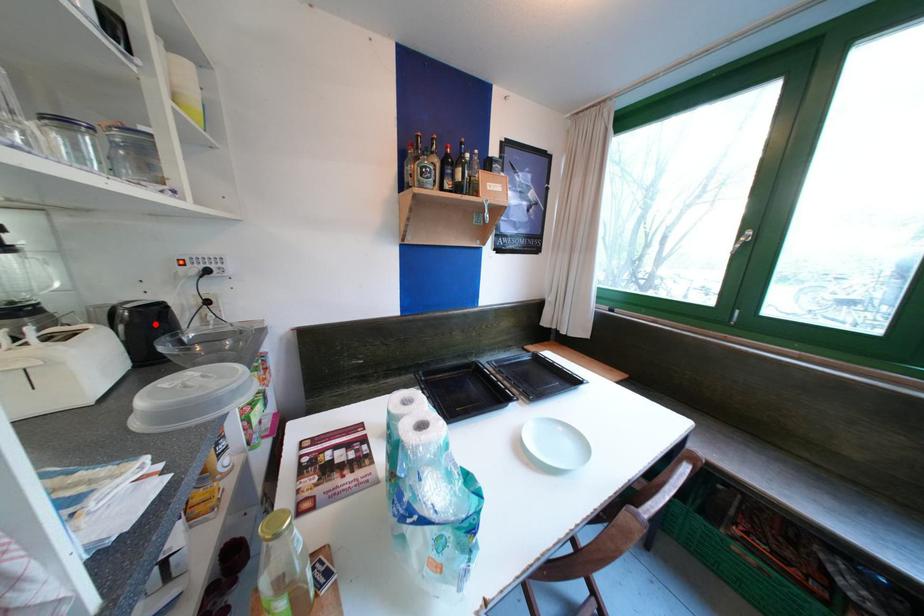
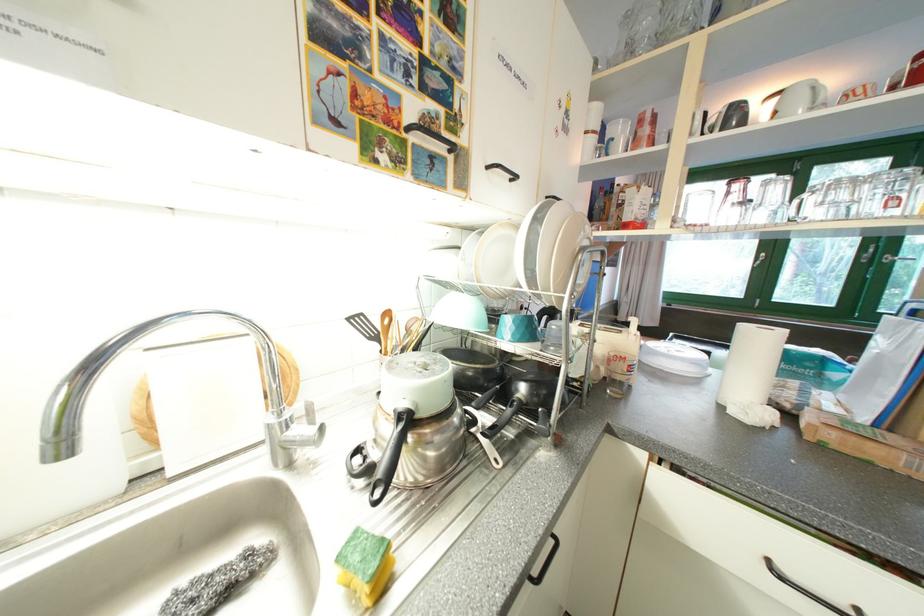
Question: I am providing you with two images of the same scene from different viewpoints. A red point is marked on the first image. At the location where the point appears in image 1, is it still visible in image 2?

Choices:
 (A) Yes
 (B) No

Answer: (B)